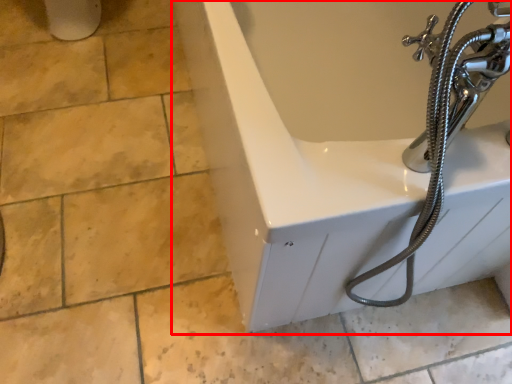
Question: From the image's perspective, considering the relative positions of bathtub (annotated by the red box) and garden hose in the image provided, where is bathtub (annotated by the red box) located with respect to the staircase?

Choices:
 (A) above
 (B) below

Answer: (A)